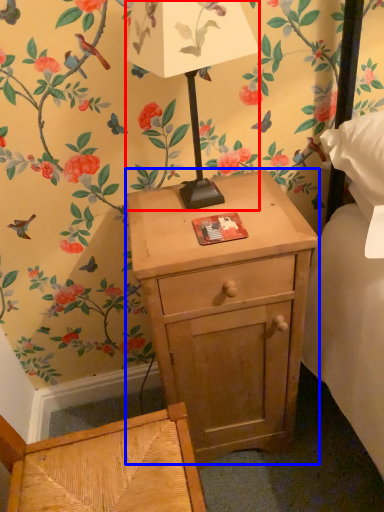
Question: Among these objects, which one is farthest to the camera, table lamp (highlighted by a red box) or nightstand (highlighted by a blue box)?

Choices:
 (A) table lamp
 (B) nightstand

Answer: (B)